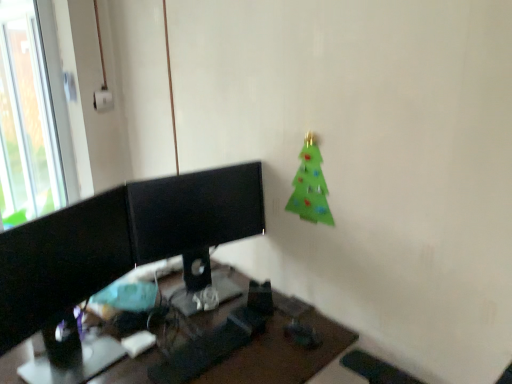
Question: Does black plastic desk at center have a greater width compared to black glossy monitor at left?

Choices:
 (A) no
 (B) yes

Answer: (B)

Question: Is black plastic desk at center smaller than black glossy monitor at left?

Choices:
 (A) no
 (B) yes

Answer: (A)

Question: From a real-world perspective, does black plastic desk at center sit lower than black glossy monitor at left?

Choices:
 (A) no
 (B) yes

Answer: (B)

Question: Is black plastic desk at center placed right next to black glossy monitor at left?

Choices:
 (A) no
 (B) yes

Answer: (A)

Question: From the image's perspective, is black plastic desk at center on top of black glossy monitor at left?

Choices:
 (A) no
 (B) yes

Answer: (A)

Question: Is black glossy monitor at left to the left or to the right of black glossy monitor at center in the image?

Choices:
 (A) right
 (B) left

Answer: (B)

Question: From a real-world perspective, relative to black glossy monitor at center, is black glossy monitor at left vertically above or below?

Choices:
 (A) above
 (B) below

Answer: (A)

Question: Considering the positions of black glossy monitor at left and black glossy monitor at center in the image, is black glossy monitor at left wider or thinner than black glossy monitor at center?

Choices:
 (A) thin
 (B) wide

Answer: (B)

Question: Considering their positions, is black glossy monitor at left located in front of or behind black glossy monitor at center?

Choices:
 (A) front
 (B) behind

Answer: (A)

Question: From the image's perspective, is green felt christmas tree at upper right positioned above or below black glossy monitor at left?

Choices:
 (A) below
 (B) above

Answer: (B)

Question: Considering the relative positions of green felt christmas tree at upper right and black glossy monitor at left in the image provided, is green felt christmas tree at upper right to the left or to the right of black glossy monitor at left?

Choices:
 (A) right
 (B) left

Answer: (A)

Question: Considering the positions of green felt christmas tree at upper right and black glossy monitor at left in the image, is green felt christmas tree at upper right bigger or smaller than black glossy monitor at left?

Choices:
 (A) big
 (B) small

Answer: (B)

Question: From their relative heights in the image, would you say green felt christmas tree at upper right is taller or shorter than black glossy monitor at left?

Choices:
 (A) short
 (B) tall

Answer: (A)

Question: Is black plastic desk at center taller or shorter than green felt christmas tree at upper right?

Choices:
 (A) short
 (B) tall

Answer: (B)

Question: Is black plastic desk at center bigger or smaller than green felt christmas tree at upper right?

Choices:
 (A) small
 (B) big

Answer: (B)